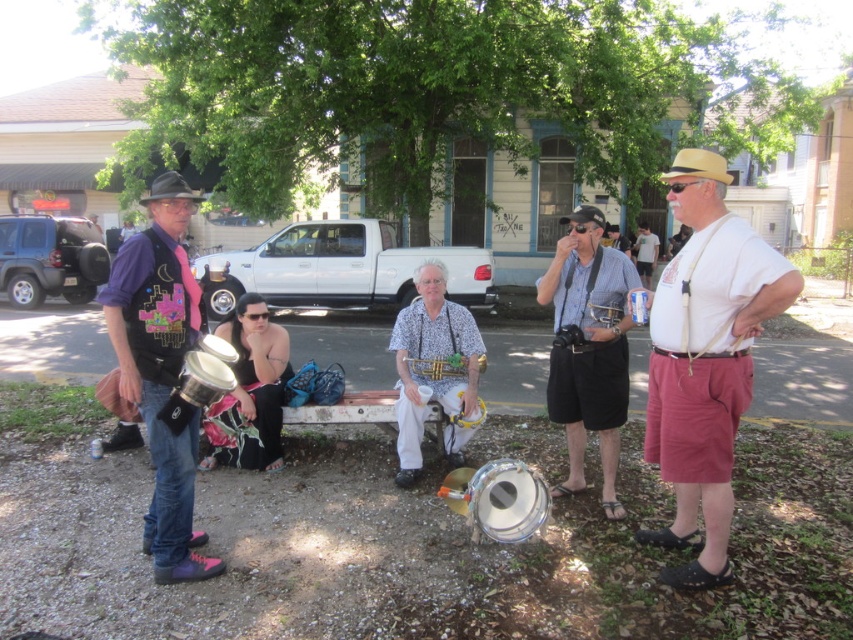
Question: Which of the following is the closest to the observer?

Choices:
 (A) white cotton shirt at right
 (B) black leather shorts at center
 (C) metallic drum at left
 (D) silver metallic drum at lower center

Answer: (A)

Question: Is black leather shorts at center above brushed metal cymbal at center?

Choices:
 (A) no
 (B) yes

Answer: (A)

Question: Which point is closer to the camera?

Choices:
 (A) (668, 436)
 (B) (416, 360)
 (C) (566, 369)
 (D) (606, 301)

Answer: (A)

Question: Is tan straw cowboy hat at upper center wider than black felt cowboy hat at left?

Choices:
 (A) no
 (B) yes

Answer: (A)

Question: Can you confirm if shiny purple shirt at left is positioned above metallic drum at left?

Choices:
 (A) no
 (B) yes

Answer: (A)

Question: Among these points, which one is farthest from the camera?

Choices:
 (A) (508, 516)
 (B) (590, 237)

Answer: (B)